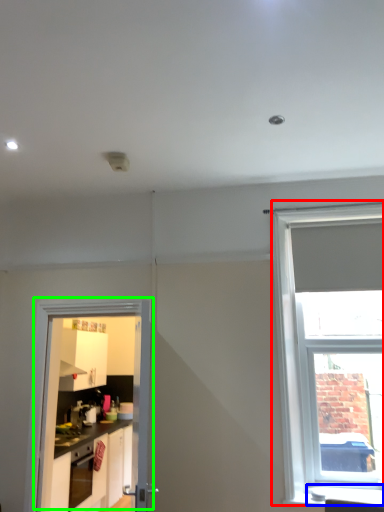
Question: Estimate the real-world distances between objects in this image. Which object is closer to window (highlighted by a red box), window sill (highlighted by a blue box) or door (highlighted by a green box)?

Choices:
 (A) window sill
 (B) door

Answer: (A)